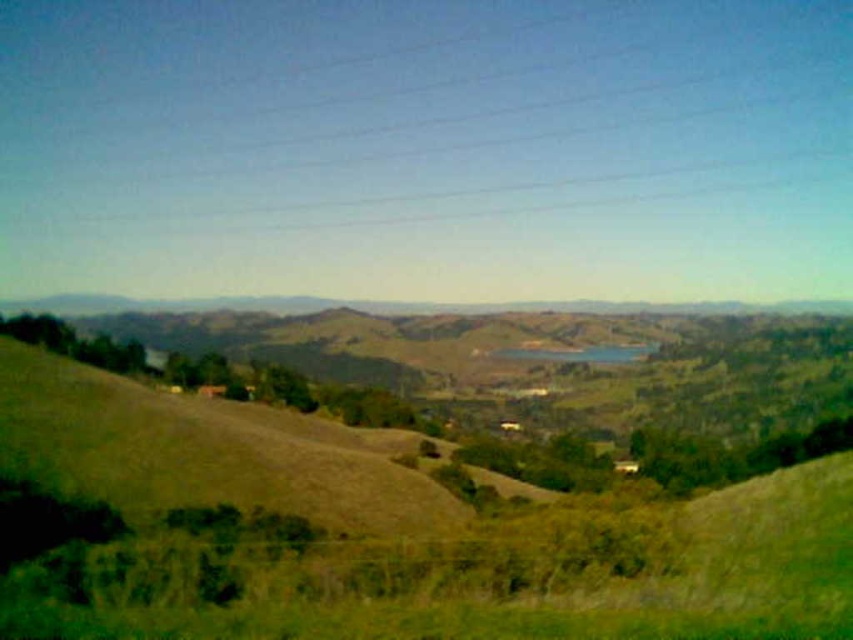
You are planning to set up a picnic area and have two options for locations in the image. The first is the green grassy hillside at lower center, and the second is the blue glass lake at center. Based on the size of the areas, which location would allow for more space to set up your picnic?

The green grassy hillside at lower center is larger in size than the blue glass lake at center, so it would provide more space for setting up the picnic.

You are a hiker standing at the base of the green grassy hillside at lower center and want to reach the blue glass lake at center. Which direction should you go to descend towards the lake?

You should go towards the blue glass lake at center because the green grassy hillside at lower center is taller than the blue glass lake at center, so descending towards the lake will lead you downward.

You are standing at the point labeled point (x=834, y=538) and want to walk towards the point labeled point (x=561, y=355). Given that the path between them is clear, will you be moving towards the foreground or background of the image?

Since point (x=834, y=538) is closer to the camera than point (x=561, y=355), moving from point (x=834, y=538) to point (x=561, y=355) means you are moving towards the background of the image.